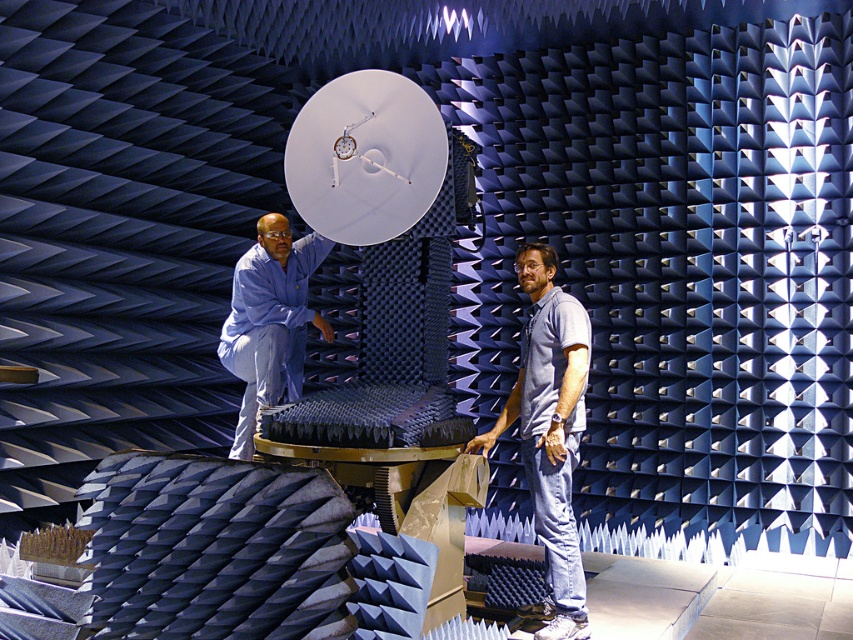
Which is behind, point (293, 161) or point (581, 577)?

The point (293, 161) is more distant.

Is point (374, 202) behind point (567, 568)?

That is True.

You are a GUI agent. You are given a task and a screenshot of the screen. Output one action in this format:
    pyautogui.click(x=<x>, y=<y>)
    Task: Click on the white matte satellite at center
    The height and width of the screenshot is (640, 853).
    Given the screenshot: What is the action you would take?
    pyautogui.click(x=364, y=157)

Is point (434, 108) closer to camera compared to point (257, 276)?

That is True.

Is white matte satellite at center bigger than blue fabric shirt at upper left?

Incorrect, white matte satellite at center is not larger than blue fabric shirt at upper left.

Is point (352, 227) closer to viewer compared to point (289, 385)?

That is True.

I want to click on white matte satellite at center, so click(x=364, y=157).

Which is below, light blue denim jeans at center or blue fabric shirt at upper left?

Positioned lower is light blue denim jeans at center.

Is light blue denim jeans at center to the left of blue fabric shirt at upper left from the viewer's perspective?

In fact, light blue denim jeans at center is to the right of blue fabric shirt at upper left.

Who is more distant from viewer, (x=477, y=436) or (x=238, y=320)?

Point (x=238, y=320)

Image resolution: width=853 pixels, height=640 pixels. I want to click on light blue denim jeans at center, so click(x=550, y=429).